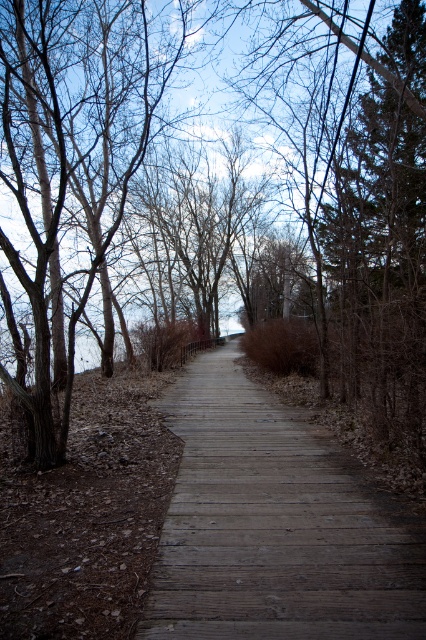
Is brown wood tree at center wider than wooden boardwalk at center?

Yes.

Can you confirm if brown wood tree at center is taller than wooden boardwalk at center?

Yes, brown wood tree at center is taller than wooden boardwalk at center.

Identify the location of brown wood tree at center. Image resolution: width=426 pixels, height=640 pixels. (215, 189).